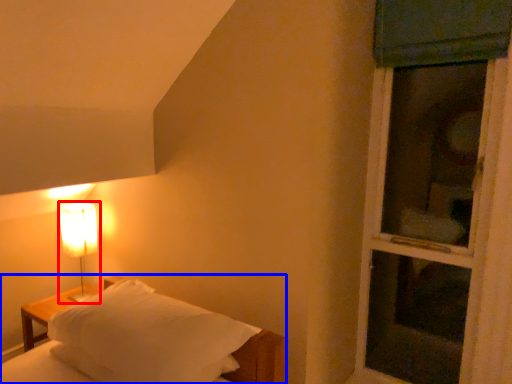
Question: Among these objects, which one is farthest to the camera, lamp (highlighted by a red box) or bed (highlighted by a blue box)?

Choices:
 (A) lamp
 (B) bed

Answer: (A)